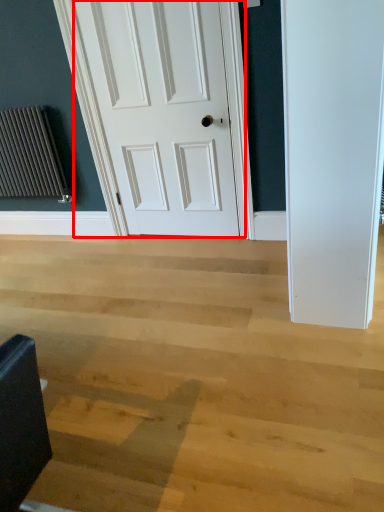
Question: From the image's perspective, where is door (annotated by the red box) located in relation to radiator in the image?

Choices:
 (A) below
 (B) above

Answer: (B)